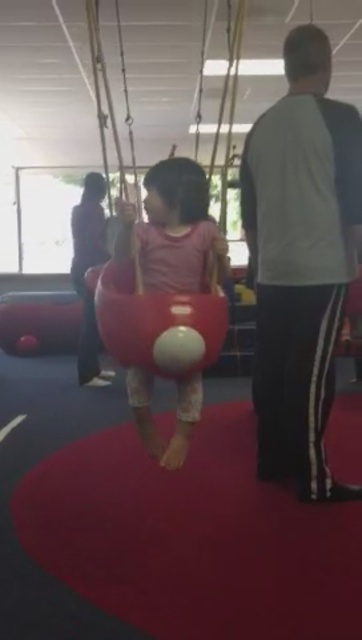
Question: From the image, what is the correct spatial relationship of white/black track pants at right in relation to matte pink swing at center?

Choices:
 (A) right
 (B) left

Answer: (A)

Question: Which object is positioned closest to the matte pink swing at center?

Choices:
 (A) matte plastic swing at center
 (B) white/black track pants at right

Answer: (A)

Question: Which object appears closest to the camera in this image?

Choices:
 (A) white/black track pants at right
 (B) matte plastic swing at center

Answer: (B)

Question: Which object is farther from the camera taking this photo?

Choices:
 (A) white/black track pants at right
 (B) matte plastic swing at center
 (C) matte pink swing at center

Answer: (A)

Question: Can you confirm if matte pink swing at center is wider than matte plastic swing at center?

Choices:
 (A) yes
 (B) no

Answer: (B)

Question: From the image, what is the correct spatial relationship of matte pink swing at center in relation to matte plastic swing at center?

Choices:
 (A) below
 (B) above

Answer: (B)